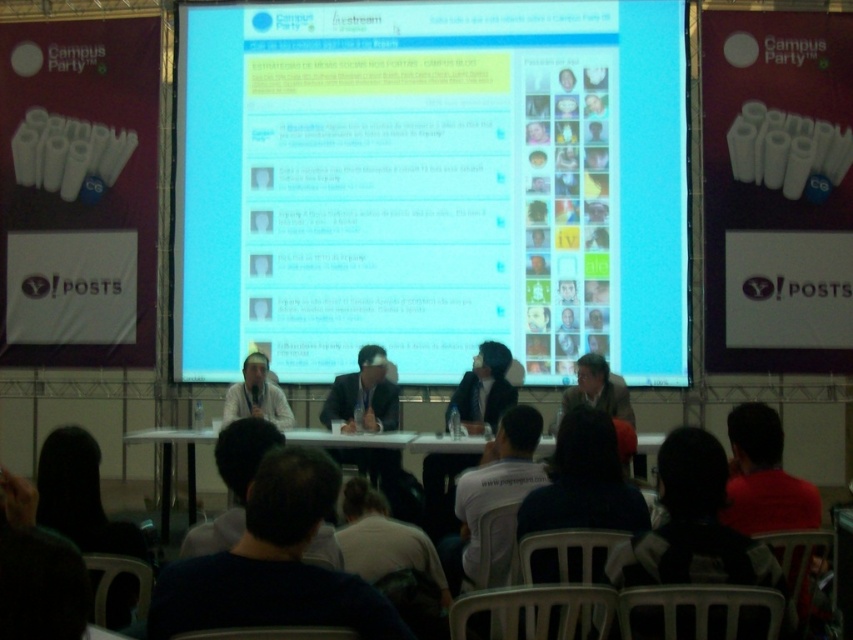
Question: Can you confirm if black fabric at lower right is smaller than white plastic table at center?

Choices:
 (A) yes
 (B) no

Answer: (B)

Question: Observing the image, what is the correct spatial positioning of white matte shirt at center in reference to dark blue shirt at center?

Choices:
 (A) below
 (B) above

Answer: (B)

Question: Based on their relative distances, which object is nearer to the dark blue shirt at center?

Choices:
 (A) white glossy screen at center
 (B) light brown leather jacket at center
 (C) white plastic table at center

Answer: (B)

Question: Which of these objects is positioned closest to the dark suit at center?

Choices:
 (A) dark blue shirt at lower center
 (B) white glossy screen at center
 (C) black fabric at lower right
 (D) light brown leather jacket at center

Answer: (B)

Question: Can you confirm if black fabric at lower right is thinner than light beige fabric shirt at center?

Choices:
 (A) yes
 (B) no

Answer: (A)

Question: Which point is farther to the camera?

Choices:
 (A) white glossy screen at center
 (B) black fabric at lower right

Answer: (A)